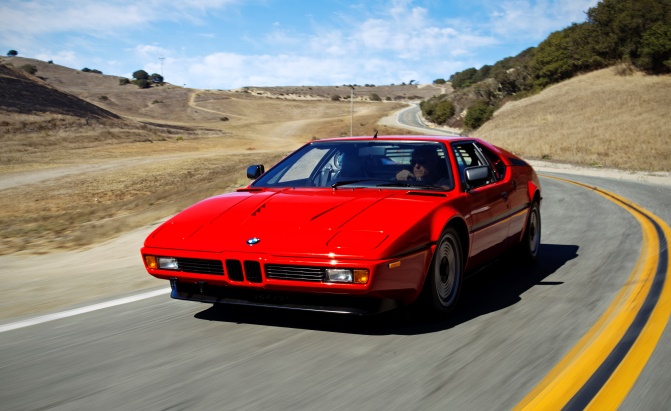
At what (x,y) coordinates should I click in order to perform the action: click on lights. Please return your answer as a coordinate pair (x, y). This screenshot has width=671, height=411. Looking at the image, I should click on (342, 274), (362, 273), (166, 265), (144, 270).